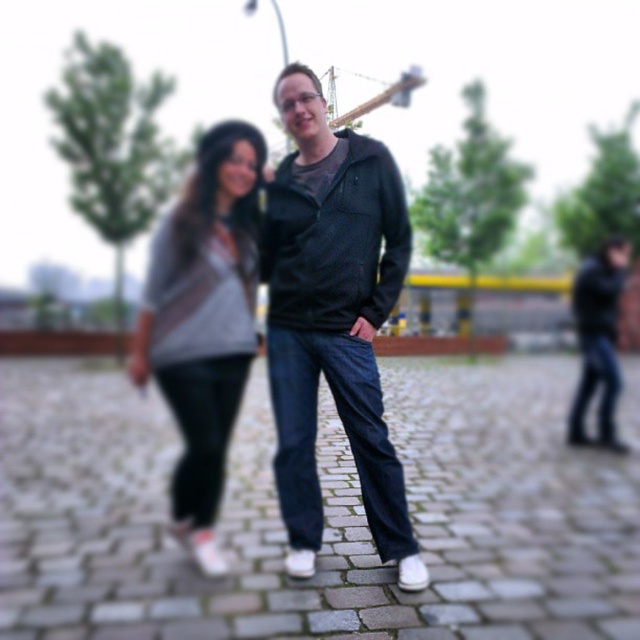
Question: Which point is farther to the camera?

Choices:
 (A) (170, 243)
 (B) (298, 365)
 (C) (589, 308)

Answer: (C)

Question: Does matte black jacket at center have a larger size compared to matte gray sweater at center?

Choices:
 (A) no
 (B) yes

Answer: (A)

Question: Does matte black jacket at center appear on the left side of dark blue jeans at right?

Choices:
 (A) yes
 (B) no

Answer: (A)

Question: Is matte black jacket at center positioned in front of matte gray sweater at center?

Choices:
 (A) no
 (B) yes

Answer: (B)

Question: Which object appears closest to the camera in this image?

Choices:
 (A) matte gray sweater at center
 (B) dark blue jeans at right
 (C) matte black jacket at center

Answer: (C)

Question: Which is nearer to the matte gray sweater at center?

Choices:
 (A) matte black jacket at center
 (B) dark blue jeans at right

Answer: (A)